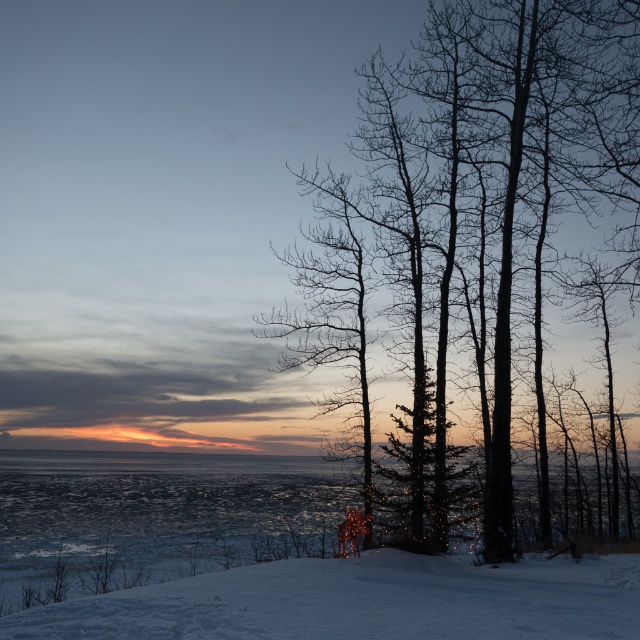
You are standing in the winter scene and want to take a photo of both point (528, 99) and point (570, 602). Which point should you focus on first to ensure both are in focus?

You should focus on point (528, 99) first because it is closer to the camera than point (570, 602). By focusing on the closer point, the depth of field may extend to include the farther point as well.

From the picture: You are an observer standing in the snowy landscape. You see the silhouette bare tree at right and the white powdery snow at lower center. Which object is closer to you?

The white powdery snow at lower center is closer to you because it is at the lower part of the image, typically indicating foreground elements in such compositions.